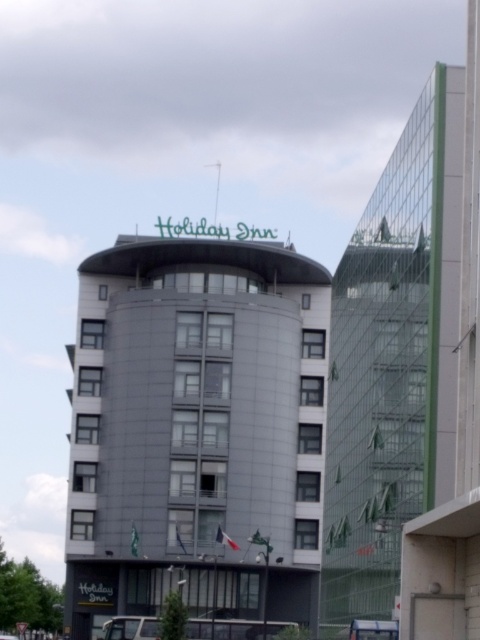
Is point (123, 342) more distant than point (385, 314)?

Yes, it is behind point (385, 314).

Does point (325, 364) come closer to viewer compared to point (385, 435)?

No, it is behind (385, 435).

Identify the location of gray concrete building at center. This screenshot has height=640, width=480. (195, 428).